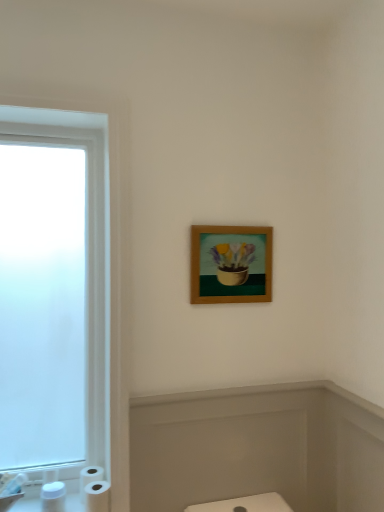
Question: Is white matte toilet paper at lower left completely or partially inside white glossy sink at lower left?

Choices:
 (A) no
 (B) yes

Answer: (A)

Question: Is white glossy sink at lower left positioned beyond the bounds of white matte toilet paper at lower left?

Choices:
 (A) no
 (B) yes

Answer: (B)

Question: Is white glossy sink at lower left not close to white matte toilet paper at lower left?

Choices:
 (A) yes
 (B) no

Answer: (B)

Question: Does white glossy sink at lower left appear on the right side of white matte toilet paper at lower left?

Choices:
 (A) yes
 (B) no

Answer: (B)

Question: Is white glossy sink at lower left taller than white matte toilet paper at lower left?

Choices:
 (A) no
 (B) yes

Answer: (A)

Question: Is white matte toilet paper at lower left wider or thinner than white glossy sink at lower left?

Choices:
 (A) wide
 (B) thin

Answer: (B)

Question: Based on their positions, is white matte toilet paper at lower left located to the left or right of white glossy sink at lower left?

Choices:
 (A) right
 (B) left

Answer: (A)

Question: Considering the positions of white matte toilet paper at lower left and white glossy sink at lower left in the image, is white matte toilet paper at lower left bigger or smaller than white glossy sink at lower left?

Choices:
 (A) big
 (B) small

Answer: (B)

Question: From a real-world perspective, is white matte toilet paper at lower left positioned above or below white glossy sink at lower left?

Choices:
 (A) above
 (B) below

Answer: (B)

Question: From the image's perspective, relative to matte white bathtub at lower center, is white matte toilet paper at lower left above or below?

Choices:
 (A) above
 (B) below

Answer: (B)

Question: Looking at their shapes, would you say white matte toilet paper at lower left is wider or thinner than matte white bathtub at lower center?

Choices:
 (A) thin
 (B) wide

Answer: (B)

Question: In terms of height, does white matte toilet paper at lower left look taller or shorter compared to matte white bathtub at lower center?

Choices:
 (A) short
 (B) tall

Answer: (A)

Question: In the image, is white matte toilet paper at lower left positioned in front of or behind matte white bathtub at lower center?

Choices:
 (A) behind
 (B) front

Answer: (A)

Question: From the image's perspective, is white matte toilet paper at lower left located above or below white glossy sink at lower left?

Choices:
 (A) above
 (B) below

Answer: (B)

Question: Considering the positions of white matte toilet paper at lower left and white glossy sink at lower left in the image, is white matte toilet paper at lower left bigger or smaller than white glossy sink at lower left?

Choices:
 (A) small
 (B) big

Answer: (A)